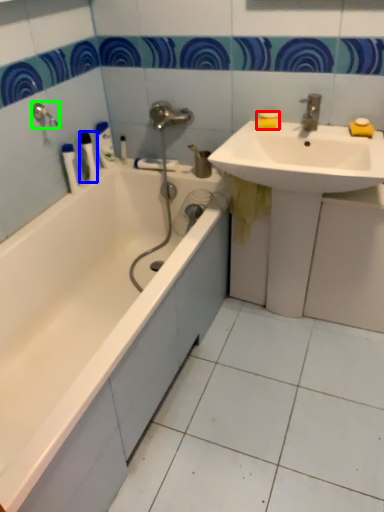
Question: Estimate the real-world distances between objects in this image. Which object is farther from soap (highlighted by a red box), toiletry (highlighted by a blue box) or shower (highlighted by a green box)?

Choices:
 (A) toiletry
 (B) shower

Answer: (B)